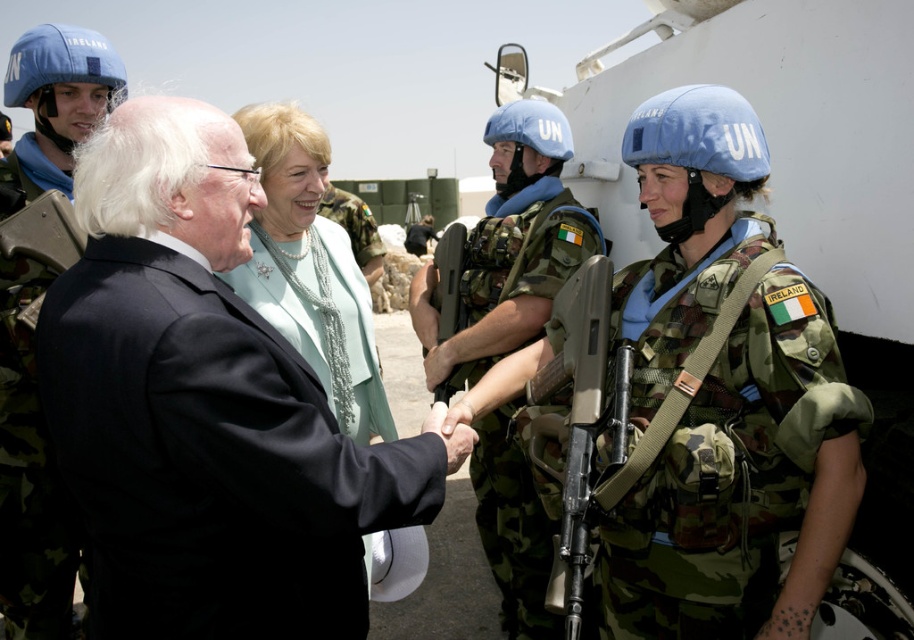
Question: Does matte black rifle at center have a greater width compared to blue fabric un helmet at center?

Choices:
 (A) yes
 (B) no

Answer: (B)

Question: Is light green fabric at center thinner than camouflage-patterned rifle at center?

Choices:
 (A) yes
 (B) no

Answer: (B)

Question: Is matte black rifle at center positioned in front of blue fabric helmet at center?

Choices:
 (A) yes
 (B) no

Answer: (A)

Question: Among these objects, which one is nearest to the camera?

Choices:
 (A) light green fabric at center
 (B) blue helmet at upper left
 (C) blue fabric helmet at upper left

Answer: (A)

Question: Which object is positioned closest to the light green fabric at center?

Choices:
 (A) camouflage uniform at center
 (B) blue fabric helmet at upper left
 (C) blue fabric un helmet at center
 (D) camouflage-patterned rifle at center

Answer: (D)

Question: Which point is closer to the camera taking this photo?

Choices:
 (A) (323, 241)
 (B) (445, 234)
 (C) (750, 244)

Answer: (C)